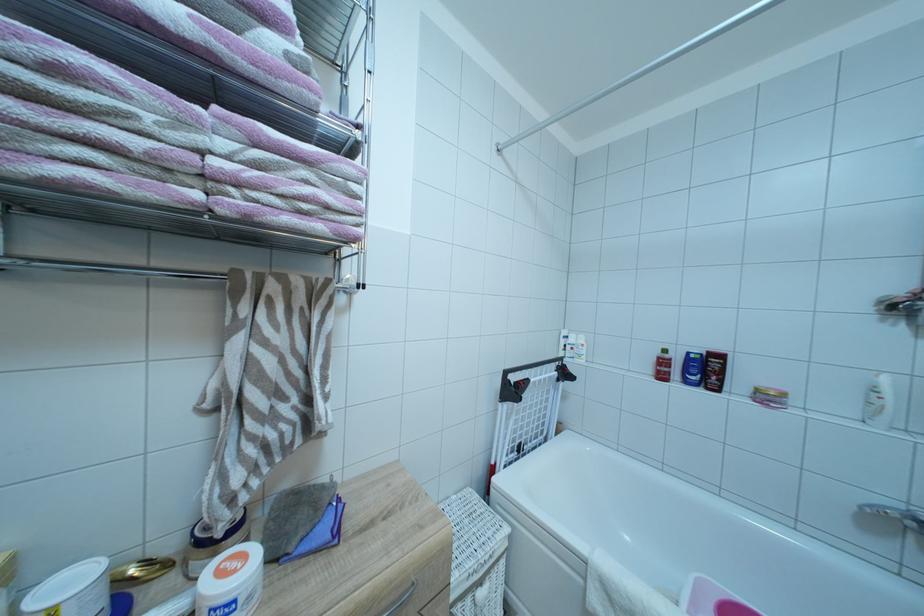
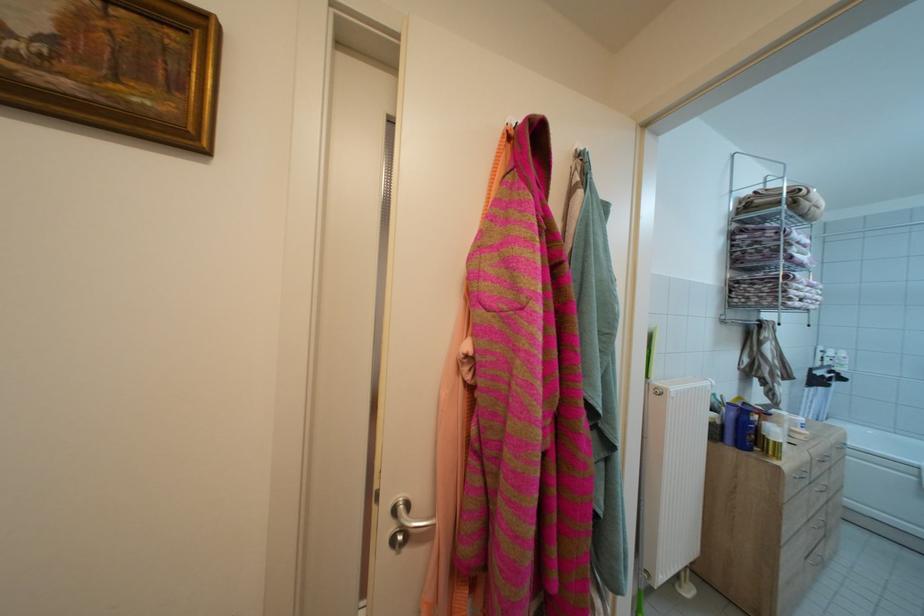
Based on the photo, in a continuous first-person perspective shot, in which direction is the camera moving?

The movement direction of the cameraman is left, backward.